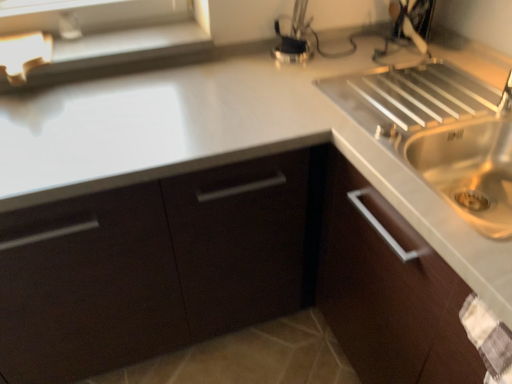
Question: Does matte white window sill at upper left have a smaller size compared to matte dark brown cabinet at center?

Choices:
 (A) no
 (B) yes

Answer: (B)

Question: Is matte dark brown cabinet at center at the back of matte white window sill at upper left?

Choices:
 (A) no
 (B) yes

Answer: (A)

Question: From the image's perspective, is matte white window sill at upper left beneath matte dark brown cabinet at center?

Choices:
 (A) no
 (B) yes

Answer: (A)

Question: Is matte white window sill at upper left positioned beyond the bounds of matte dark brown cabinet at center?

Choices:
 (A) no
 (B) yes

Answer: (B)

Question: From the image's perspective, is matte white window sill at upper left above matte dark brown cabinet at center?

Choices:
 (A) yes
 (B) no

Answer: (A)

Question: Considering the relative sizes of matte white window sill at upper left and matte dark brown cabinet at center in the image provided, is matte white window sill at upper left shorter than matte dark brown cabinet at center?

Choices:
 (A) yes
 (B) no

Answer: (A)

Question: Is matte dark brown cabinet at center bigger than matte white window sill at upper left?

Choices:
 (A) no
 (B) yes

Answer: (B)

Question: Is the position of matte dark brown cabinet at center more distant than that of matte white window sill at upper left?

Choices:
 (A) yes
 (B) no

Answer: (B)

Question: From the image's perspective, is matte dark brown cabinet at center located beneath matte white window sill at upper left?

Choices:
 (A) no
 (B) yes

Answer: (B)

Question: Is matte dark brown cabinet at center positioned in front of matte white window sill at upper left?

Choices:
 (A) yes
 (B) no

Answer: (A)

Question: Can you confirm if matte dark brown cabinet at center is smaller than matte white window sill at upper left?

Choices:
 (A) no
 (B) yes

Answer: (A)

Question: Is matte dark brown cabinet at center thinner than matte white window sill at upper left?

Choices:
 (A) yes
 (B) no

Answer: (B)

Question: Considering the positions of matte white window sill at upper left and matte dark brown cabinet at center in the image, is matte white window sill at upper left bigger or smaller than matte dark brown cabinet at center?

Choices:
 (A) small
 (B) big

Answer: (A)